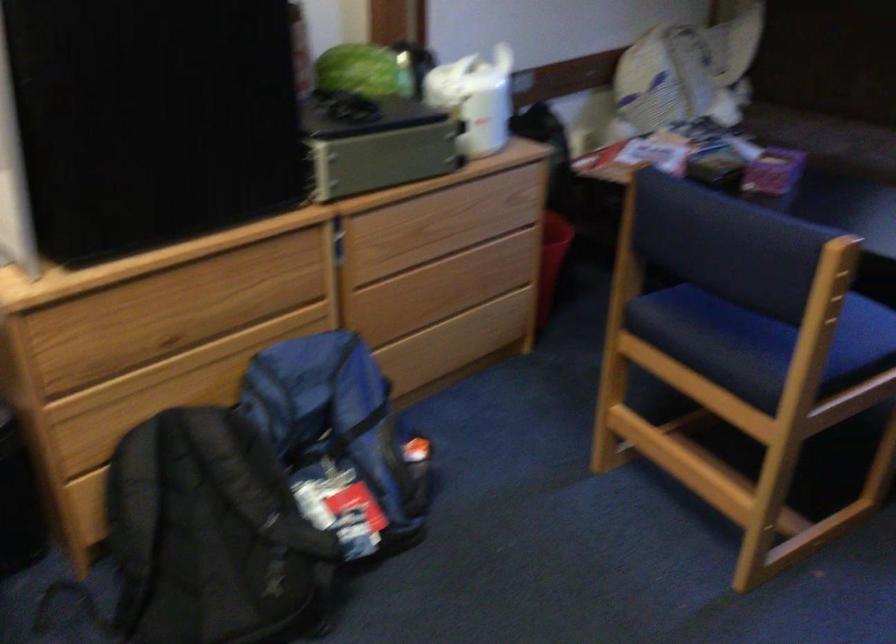
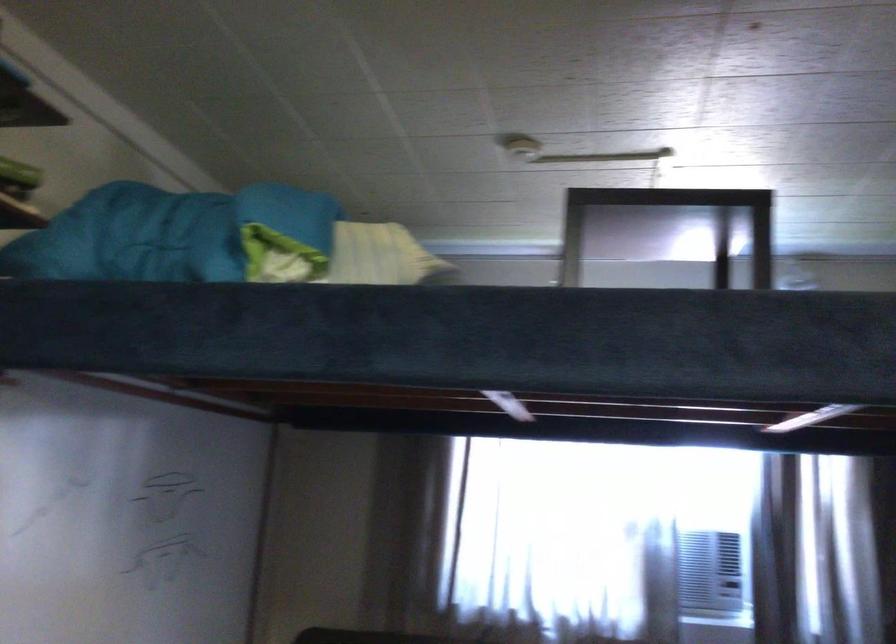
The first image is from the beginning of the video and the second image is from the end. How did the camera likely rotate when shooting the video?

The rotation direction of the camera is right-up.